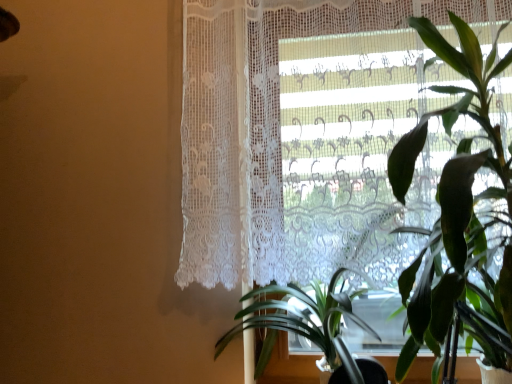
Question: From the image's perspective, would you say green leafy plant at right, the second houseplant positioned from the left, is shown under white lace curtain at upper right?

Choices:
 (A) yes
 (B) no

Answer: (A)

Question: Can you confirm if green leafy plant at right, the second houseplant positioned from the left, is taller than white lace curtain at upper right?

Choices:
 (A) no
 (B) yes

Answer: (A)

Question: Does green leafy plant at right, the first houseplant in the right-to-left sequence, touch white lace curtain at upper right?

Choices:
 (A) no
 (B) yes

Answer: (A)

Question: Could you tell me if green leafy plant at right, the first houseplant in the right-to-left sequence, is turned towards white lace curtain at upper right?

Choices:
 (A) no
 (B) yes

Answer: (A)

Question: Considering the relative sizes of green leafy plant at right, the first houseplant in the right-to-left sequence, and white lace curtain at upper right in the image provided, is green leafy plant at right, the first houseplant in the right-to-left sequence, wider than white lace curtain at upper right?

Choices:
 (A) yes
 (B) no

Answer: (A)

Question: Considering their positions, is green leafy plant at center, the second houseplant positioned from the right, located in front of or behind white lace curtain at upper right?

Choices:
 (A) front
 (B) behind

Answer: (A)

Question: From a real-world perspective, is green leafy plant at center, the second houseplant positioned from the right, above or below white lace curtain at upper right?

Choices:
 (A) below
 (B) above

Answer: (A)

Question: Considering the positions of point (284, 321) and point (389, 86), is point (284, 321) closer or farther from the camera than point (389, 86)?

Choices:
 (A) farther
 (B) closer

Answer: (A)

Question: Looking at the image, does green leafy plant at center, the first houseplant positioned from the left, seem bigger or smaller compared to white lace curtain at upper right?

Choices:
 (A) big
 (B) small

Answer: (B)

Question: In the image, is white lace curtain at upper right positioned in front of or behind green leafy plant at center, the second houseplant positioned from the right?

Choices:
 (A) front
 (B) behind

Answer: (B)

Question: Would you say white lace curtain at upper right is inside or outside green leafy plant at center, the first houseplant positioned from the left?

Choices:
 (A) outside
 (B) inside

Answer: (A)

Question: Considering the positions of point (437, 100) and point (361, 382), is point (437, 100) closer or farther from the camera than point (361, 382)?

Choices:
 (A) farther
 (B) closer

Answer: (A)

Question: From the image's perspective, is white lace curtain at upper right located above or below green leafy plant at center, the second houseplant positioned from the right?

Choices:
 (A) above
 (B) below

Answer: (A)

Question: From a real-world perspective, is green leafy plant at center, the second houseplant positioned from the right, above or below green leafy plant at right, the first houseplant in the right-to-left sequence?

Choices:
 (A) below
 (B) above

Answer: (A)

Question: Considering their positions, is green leafy plant at center, the second houseplant positioned from the right, located in front of or behind green leafy plant at right, the first houseplant in the right-to-left sequence?

Choices:
 (A) behind
 (B) front

Answer: (A)